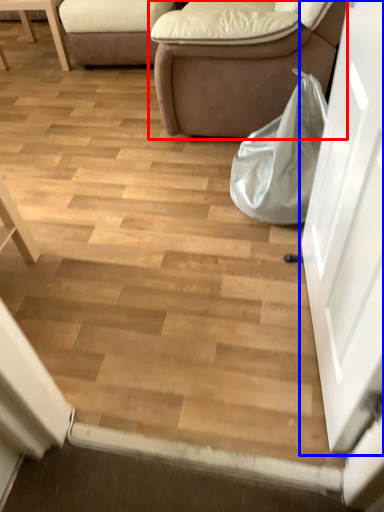
Question: Among these objects, which one is nearest to the camera, studio couch (highlighted by a red box) or door (highlighted by a blue box)?

Choices:
 (A) studio couch
 (B) door

Answer: (B)